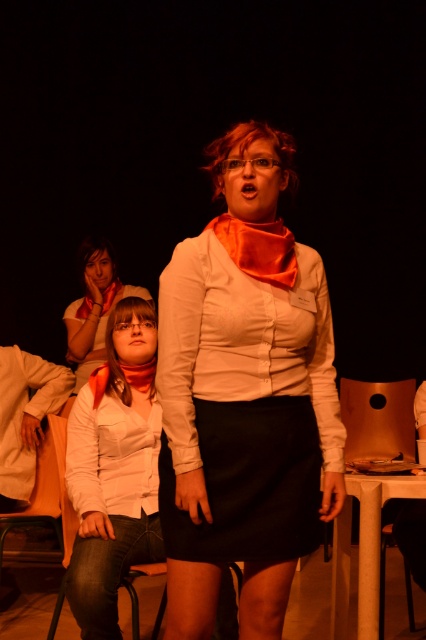
Between metallic brown chair at lower left and orange fabric scarf at lower center, which one is positioned higher?

orange fabric scarf at lower center is higher up.

From the picture: Who is more forward, [55,464] or [144,365]?

Positioned in front is point [144,365].

Between point (37, 484) and point (146, 372), which one is positioned behind?

Point (37, 484)

Image resolution: width=426 pixels, height=640 pixels. Find the location of `metallic brown chair at lower left`. metallic brown chair at lower left is located at coordinates (48, 490).

Is point (16, 435) farther from camera compared to point (264, 224)?

Yes, point (16, 435) is behind point (264, 224).

Where is `white cotton shirt at lower left`? white cotton shirt at lower left is located at coordinates (25, 419).

The height and width of the screenshot is (640, 426). I want to click on white cotton shirt at lower left, so click(x=25, y=419).

Between metallic gold chair at lower right and orange matte scarf at upper center, which one is positioned lower?

Positioned lower is metallic gold chair at lower right.

Does metallic gold chair at lower right lie behind orange matte scarf at upper center?

No, it is in front of orange matte scarf at upper center.

The height and width of the screenshot is (640, 426). In order to click on metallic gold chair at lower right in this screenshot , I will do `click(363, 548)`.